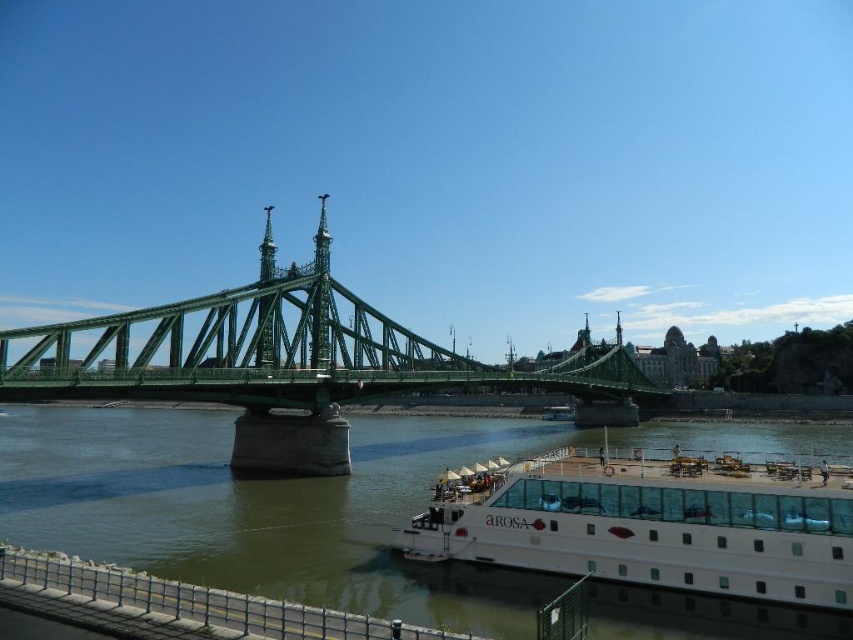
You are standing on the deck of the AROSA cruise ship and want to locate the green metallic water at lower center. According to the coordinates provided, where exactly should you look to find it?

The green metallic water at lower center is located at coordinates point (265, 508), so you should look towards that specific coordinate point to find it.

You are a tourist standing on the riverbank near the white glassy cruise ship at lower right. You want to take a photo of the green metallic bridge at center with the cruise ship in the background. Based on their positions, will the cruise ship block your view of the bridge?

The green metallic bridge at center is to the left of the white glassy cruise ship at lower right, so if you are standing near the cruise ship, the bridge would be positioned to its left side. This means the cruise ship might not fully block the bridge from your view unless you are directly in front of it. However, since the bridge is to the left of the ship, you can adjust your position slightly to the left to include both in your photo without obstruction.

You are standing on the riverbank and see the green metallic water at lower center and the green metallic bridge at center. Which object is closer to you?

The green metallic water at lower center is closer to you because it is positioned in front of the green metallic bridge at center.